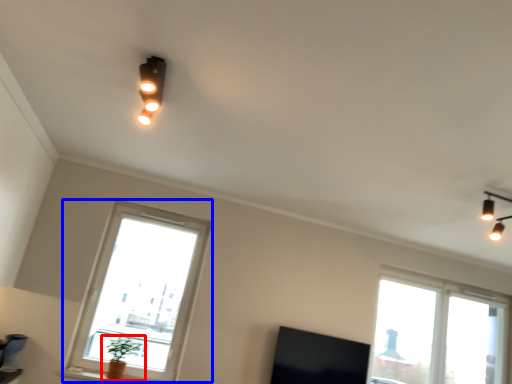
Question: Among these objects, which one is farthest to the camera, houseplant (highlighted by a red box) or window (highlighted by a blue box)?

Choices:
 (A) houseplant
 (B) window

Answer: (B)